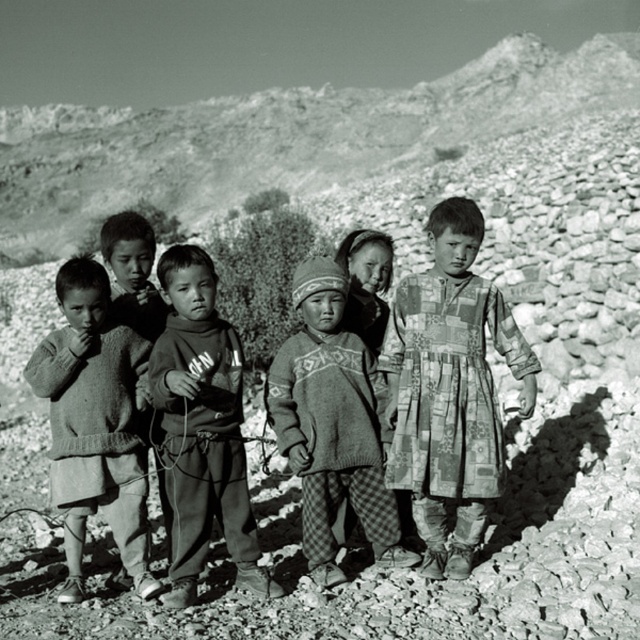
Based on the photo, can you confirm if patchwork fabric dress at center is smaller than knit sweater at center?

Incorrect, patchwork fabric dress at center is not smaller in size than knit sweater at center.

At what (x,y) coordinates should I click in order to perform the action: click on patchwork fabric dress at center. Please return your answer as a coordinate pair (x, y). This screenshot has height=640, width=640. Looking at the image, I should click on (449, 388).

I want to click on patchwork fabric dress at center, so click(x=449, y=388).

Which of these two, rugged stone hillside at upper center or knit sweater at center, stands taller?

Standing taller between the two is rugged stone hillside at upper center.

Is rugged stone hillside at upper center behind knit sweater at center?

Yes, rugged stone hillside at upper center is behind knit sweater at center.

The height and width of the screenshot is (640, 640). What do you see at coordinates (285, 138) in the screenshot?
I see `rugged stone hillside at upper center` at bounding box center [285, 138].

Locate an element on the screen. Image resolution: width=640 pixels, height=640 pixels. rugged stone hillside at upper center is located at coordinates (285, 138).

Which is below, patchwork fabric dress at center or knitted wool sweater at left?

Positioned lower is knitted wool sweater at left.

Locate an element on the screen. The height and width of the screenshot is (640, 640). patchwork fabric dress at center is located at coordinates (449, 388).

This screenshot has width=640, height=640. I want to click on patchwork fabric dress at center, so click(449, 388).

Locate an element on the screen. The image size is (640, 640). patchwork fabric dress at center is located at coordinates (449, 388).